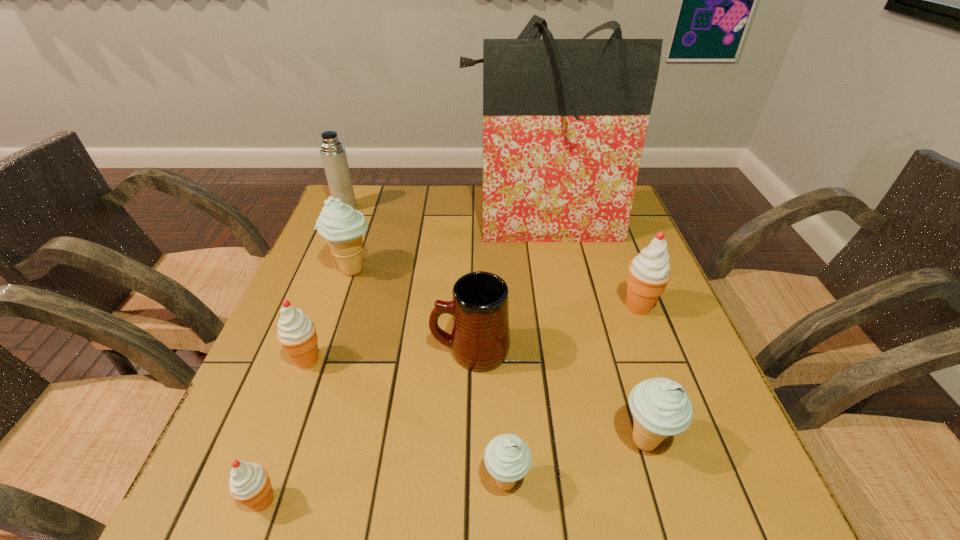
Where is `vacant area that lies between the nearest red icecream and the second smallest red icecream`? Image resolution: width=960 pixels, height=540 pixels. vacant area that lies between the nearest red icecream and the second smallest red icecream is located at coordinates (285, 430).

I want to click on free space between the farthest icecream and the mug, so click(412, 310).

You are a GUI agent. You are given a task and a screenshot of the screen. Output one action in this format:
    pyautogui.click(x=<x>, y=<y>)
    Task: Click on the free space between the smallest red icecream and the second farthest red icecream
    Image resolution: width=960 pixels, height=540 pixels.
    Given the screenshot: What is the action you would take?
    pyautogui.click(x=285, y=430)

At what (x,y) coordinates should I click in order to perform the action: click on free point between the rightmost red icecream and the smallest red icecream. Please return your answer as a coordinate pair (x, y). The height and width of the screenshot is (540, 960). Looking at the image, I should click on (450, 403).

Identify which object is the second nearest to the sixth nearest object. Please provide its 2D coordinates. Your answer should be formatted as a tuple, i.e. [(x, y)], where the tuple contains the x and y coordinates of a point satisfying the conditions above.

[(661, 408)]

You are a GUI agent. You are given a task and a screenshot of the screen. Output one action in this format:
    pyautogui.click(x=<x>, y=<y>)
    Task: Click on the eighth closest object relative to the second smallest red icecream
    This screenshot has width=960, height=540.
    Given the screenshot: What is the action you would take?
    pyautogui.click(x=649, y=272)

Select which icecream appears as the third closest to the fourth farthest object. Please provide its 2D coordinates. Your answer should be formatted as a tuple, i.e. [(x, y)], where the tuple contains the x and y coordinates of a point satisfying the conditions above.

[(342, 226)]

Identify which icecream is located as the fourth nearest to the second biggest beige icecream. Please provide its 2D coordinates. Your answer should be formatted as a tuple, i.e. [(x, y)], where the tuple contains the x and y coordinates of a point satisfying the conditions above.

[(296, 333)]

Identify which beige icecream is the second nearest to the fourth icecream from left to right. Please provide its 2D coordinates. Your answer should be formatted as a tuple, i.e. [(x, y)], where the tuple contains the x and y coordinates of a point satisfying the conditions above.

[(342, 226)]

The height and width of the screenshot is (540, 960). Find the location of `the third closest beige icecream to the black shopping bag`. the third closest beige icecream to the black shopping bag is located at coordinates (507, 457).